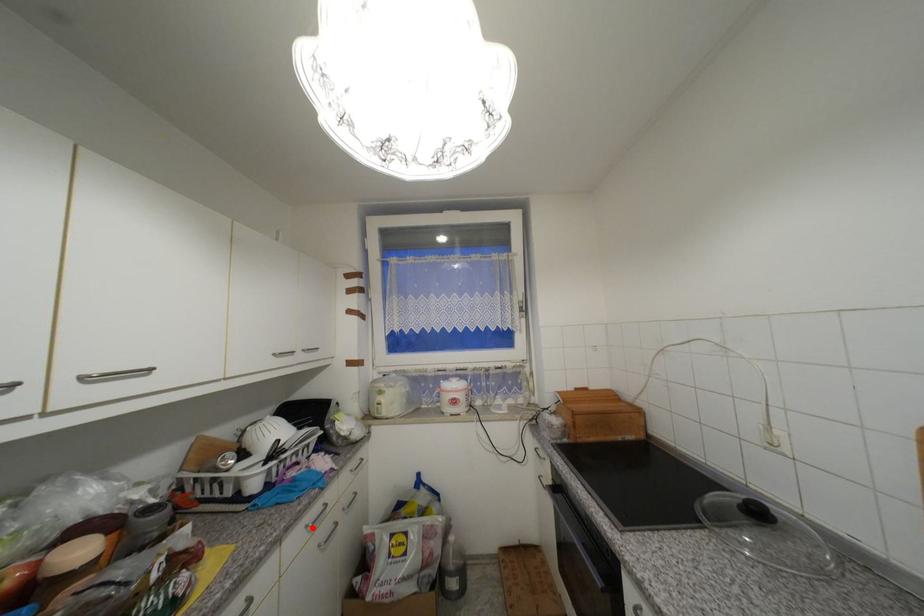
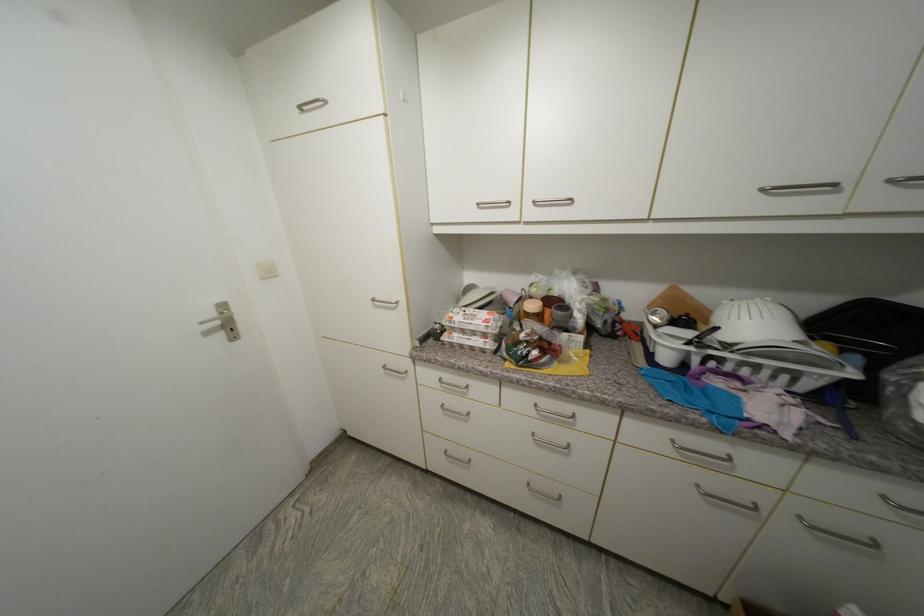
Locate, in the second image, the point that corresponds to the highlighted location in the first image.

(678, 443)